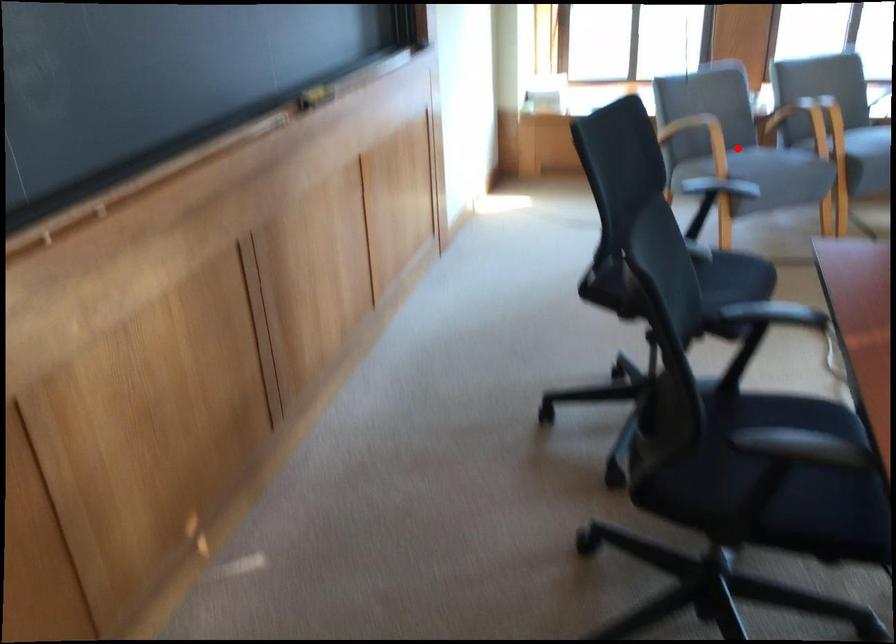
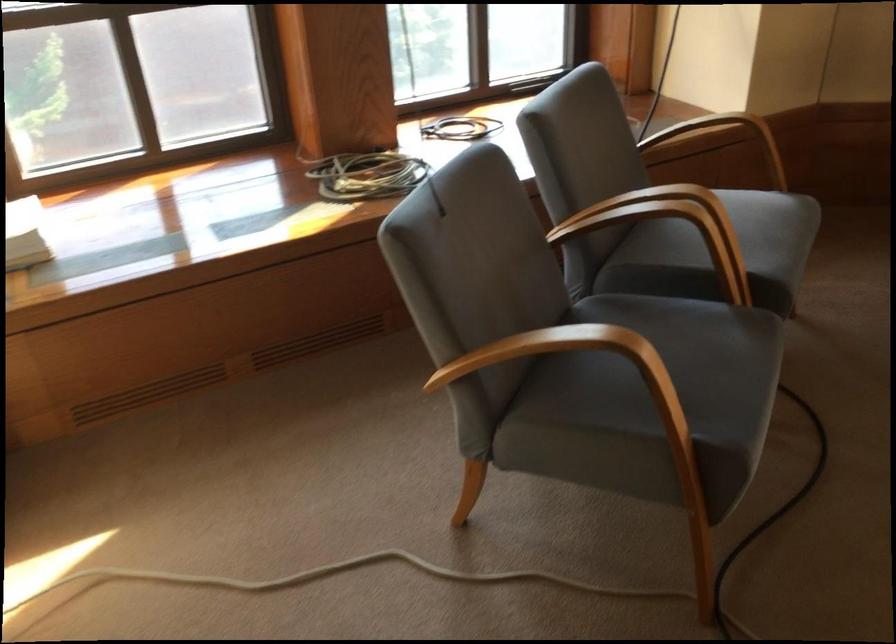
In the second image, find the point that corresponds to the highlighted location in the first image.

(650, 398)